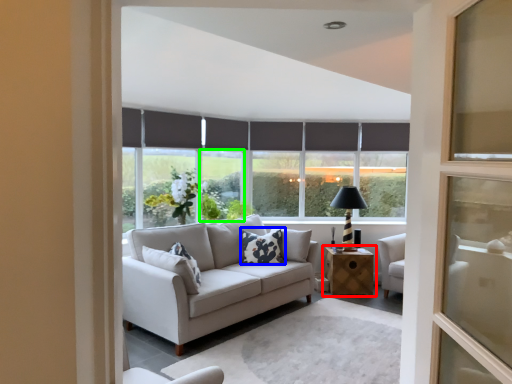
Question: Estimate the real-world distances between objects in this image. Which object is closer to table (highlighted by a red box), pillow (highlighted by a blue box) or window (highlighted by a green box)?

Choices:
 (A) pillow
 (B) window

Answer: (A)